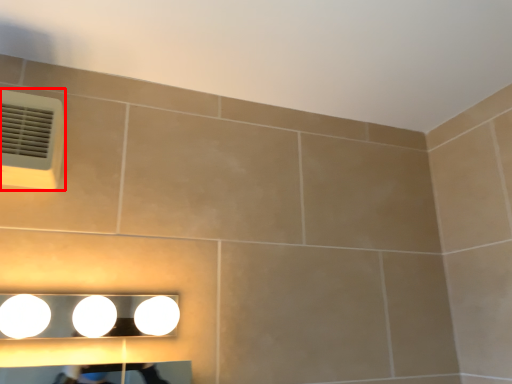
Question: Observing the image, what is the correct spatial positioning of air conditioning (annotated by the red box) in reference to fixture?

Choices:
 (A) right
 (B) left

Answer: (B)